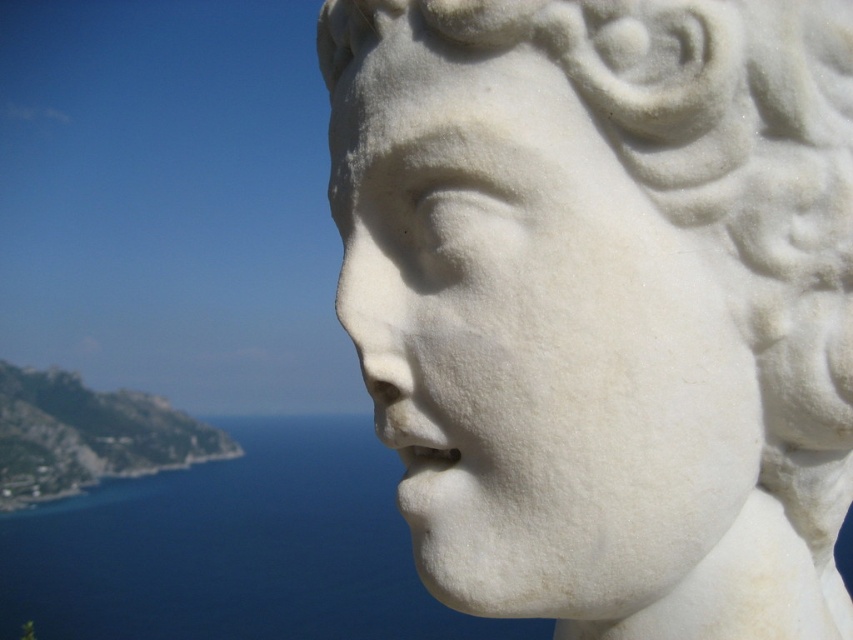
Who is higher up, white marble face at center or blue water at lower left?

white marble face at center is higher up.

Who is more forward, (399, 390) or (41, 616)?

Point (399, 390) is in front.

Where is `white marble face at center`? white marble face at center is located at coordinates (531, 340).